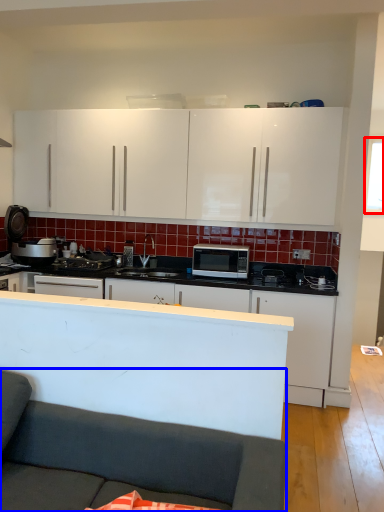
Question: Which of the following is the farthest to the observer, window screen (highlighted by a red box) or studio couch (highlighted by a blue box)?

Choices:
 (A) window screen
 (B) studio couch

Answer: (A)